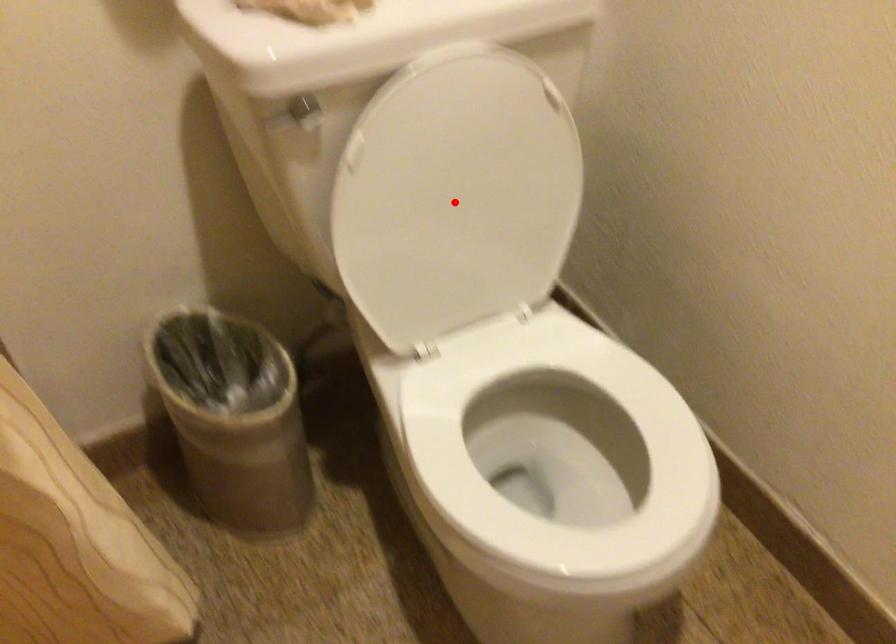
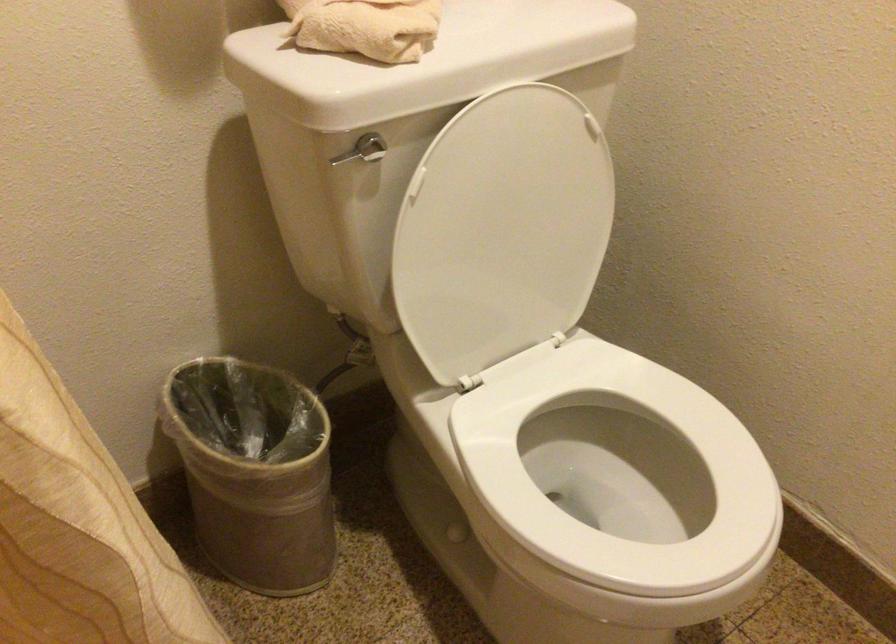
Find the pixel in the second image that matches the highlighted location in the first image.

(502, 230)